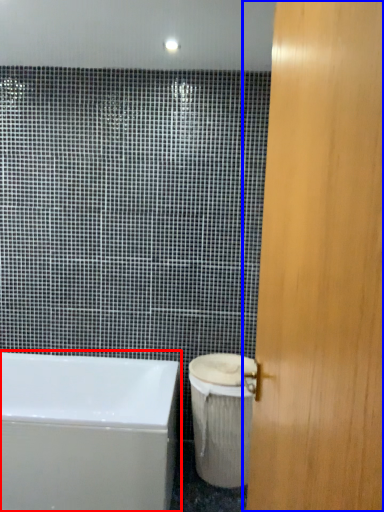
Question: Which point is closer to the camera, bathtub (highlighted by a red box) or door (highlighted by a blue box)?

Choices:
 (A) bathtub
 (B) door

Answer: (B)